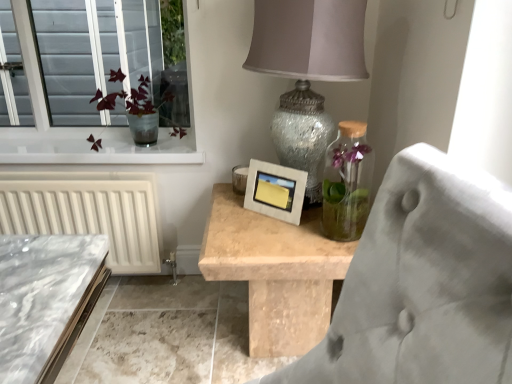
Question: Is speckled glass lampshade at upper center to the left or to the right of matte concrete picture frame at center in the image?

Choices:
 (A) right
 (B) left

Answer: (A)

Question: Is speckled glass lampshade at upper center in front of or behind matte concrete picture frame at center in the image?

Choices:
 (A) front
 (B) behind

Answer: (A)

Question: Estimate the real-world distances between objects in this image. Which object is farther from the matte concrete picture frame at center?

Choices:
 (A) speckled glass lampshade at upper center
 (B) translucent glass vase at upper left

Answer: (B)

Question: Based on their relative distances, which object is farther from the matte concrete picture frame at center?

Choices:
 (A) speckled glass lampshade at upper center
 (B) translucent glass vase at upper left

Answer: (B)